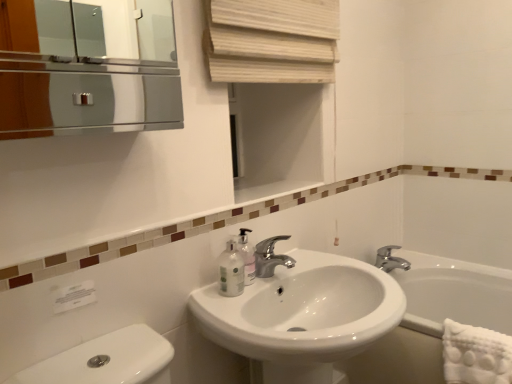
What are the coordinates of `vacant area that is in front of translucent plastic mouthwash at lower center` in the screenshot? It's located at [224, 301].